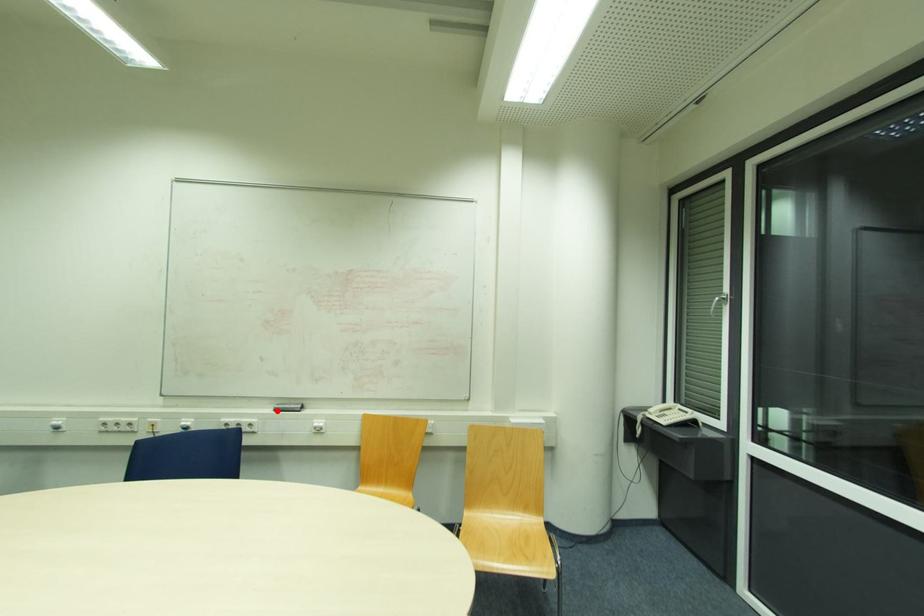
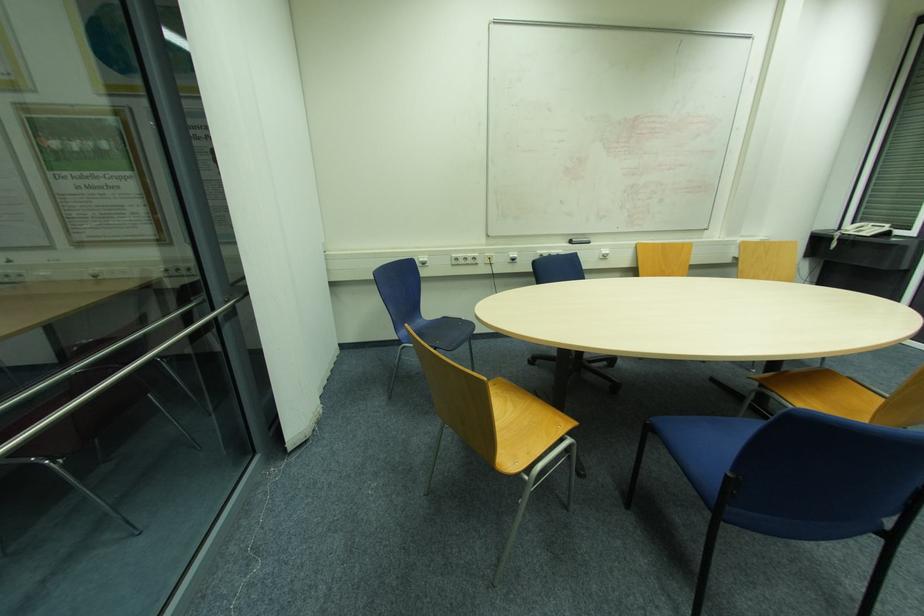
Question: I am providing you with two images of the same scene from different viewpoints. Image1 has a red point marked. In image2, the corresponding 3D location appears at what relative position? Reply with the corresponding letter.

Choices:
 (A) Closer
 (B) Farther

Answer: (A)